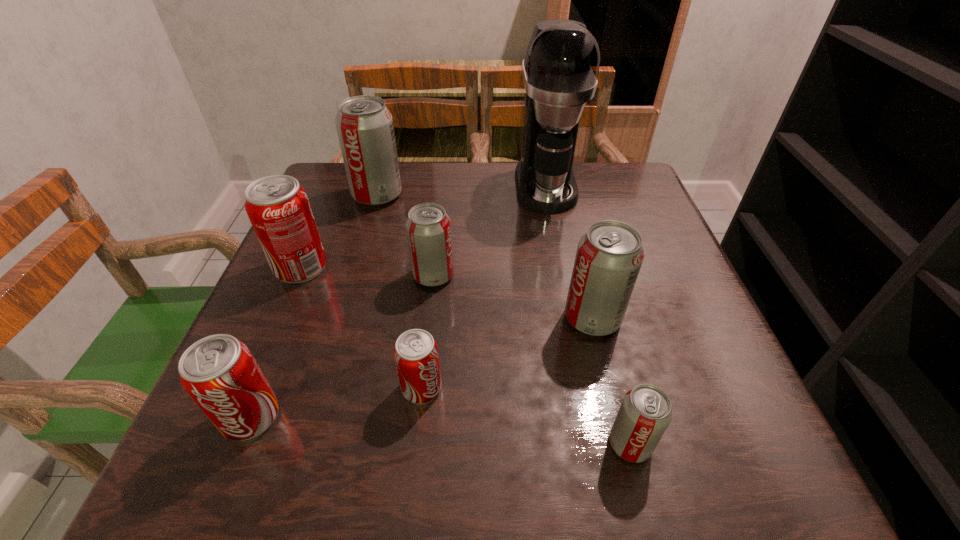
This screenshot has width=960, height=540. In order to click on object that stands as the closest to the smallest gray soda can in this screenshot , I will do `click(609, 255)`.

Locate which object ranks third in proximity to the farthest gray soda can. Please provide its 2D coordinates. Your answer should be formatted as a tuple, i.e. [(x, y)], where the tuple contains the x and y coordinates of a point satisfying the conditions above.

[(560, 70)]

Find the location of a particular element. soda can that is the fourth nearest to the third gray soda can from right to left is located at coordinates (609, 255).

Point out which soda can is positioned as the fourth nearest to the second nearest gray soda can. Please provide its 2D coordinates. Your answer should be formatted as a tuple, i.e. [(x, y)], where the tuple contains the x and y coordinates of a point satisfying the conditions above.

[(364, 124)]

Identify the location of the second closest gray soda can to the rightmost red soda can. The height and width of the screenshot is (540, 960). (609, 255).

Identify which gray soda can is the nearest to the rightmost red soda can. Please provide its 2D coordinates. Your answer should be formatted as a tuple, i.e. [(x, y)], where the tuple contains the x and y coordinates of a point satisfying the conditions above.

[(428, 227)]

Where is `red soda can that is the third closest to the coffee maker`? The image size is (960, 540). red soda can that is the third closest to the coffee maker is located at coordinates (219, 372).

Locate which red soda can is the third closest to the leftmost gray soda can. Please provide its 2D coordinates. Your answer should be formatted as a tuple, i.e. [(x, y)], where the tuple contains the x and y coordinates of a point satisfying the conditions above.

[(219, 372)]

The height and width of the screenshot is (540, 960). I want to click on vacant space that satisfies the following two spatial constraints: 1. on the front side of the nearest gray soda can; 2. on the left side of the fourth farthest soda can, so click(623, 444).